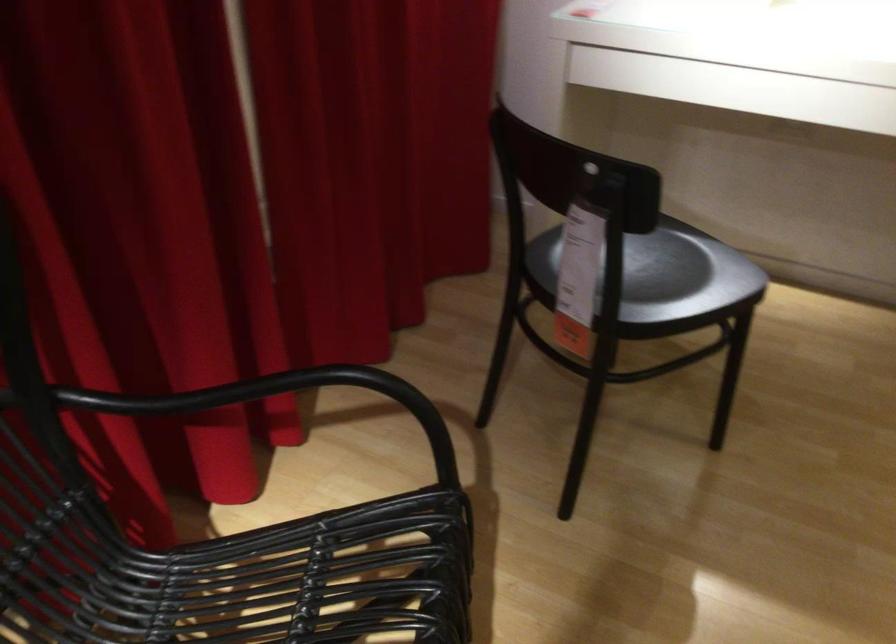
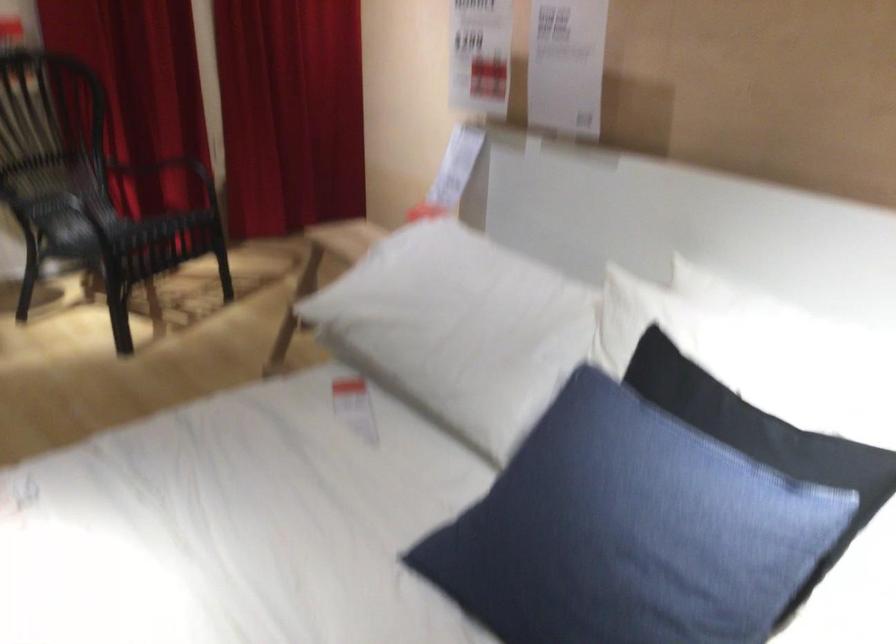
What movement of the cameraman would produce the second image?

The movement direction of the cameraman is right, backward.